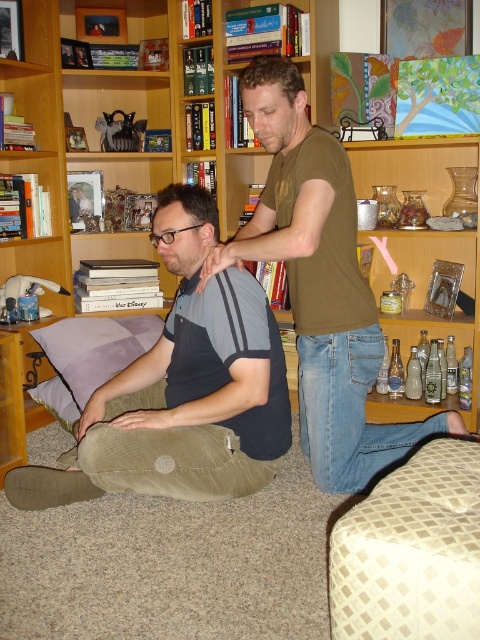
Locate an element on the screen. The image size is (480, 640). wooden bookshelf at center is located at coordinates (108, 108).

Which is below, wooden bookshelf at center or purple fabric pillow at lower left?

purple fabric pillow at lower left is lower down.

Is point (15, 157) positioned behind point (115, 369)?

Yes, point (15, 157) is farther from viewer.

Identify the location of wooden bookshelf at center. (108, 108).

Is purple fabric pillow at lower left bigger than dark brown hair at center?

Correct, purple fabric pillow at lower left is larger in size than dark brown hair at center.

Looking at this image, who is higher up, purple fabric pillow at lower left or dark brown hair at center?

dark brown hair at center

What do you see at coordinates (90, 355) in the screenshot? This screenshot has width=480, height=640. I see `purple fabric pillow at lower left` at bounding box center [90, 355].

The image size is (480, 640). In order to click on purple fabric pillow at lower left in this screenshot , I will do `click(90, 355)`.

In the scene shown: Who is higher up, matte brown shirt at center or beige checkered stool at lower right?

matte brown shirt at center

Which of these two, matte brown shirt at center or beige checkered stool at lower right, stands shorter?

With less height is beige checkered stool at lower right.

Is point (343, 392) closer to viewer compared to point (355, 618)?

No, (343, 392) is behind (355, 618).

The width and height of the screenshot is (480, 640). What are the coordinates of `matte brown shirt at center` in the screenshot? It's located at (322, 296).